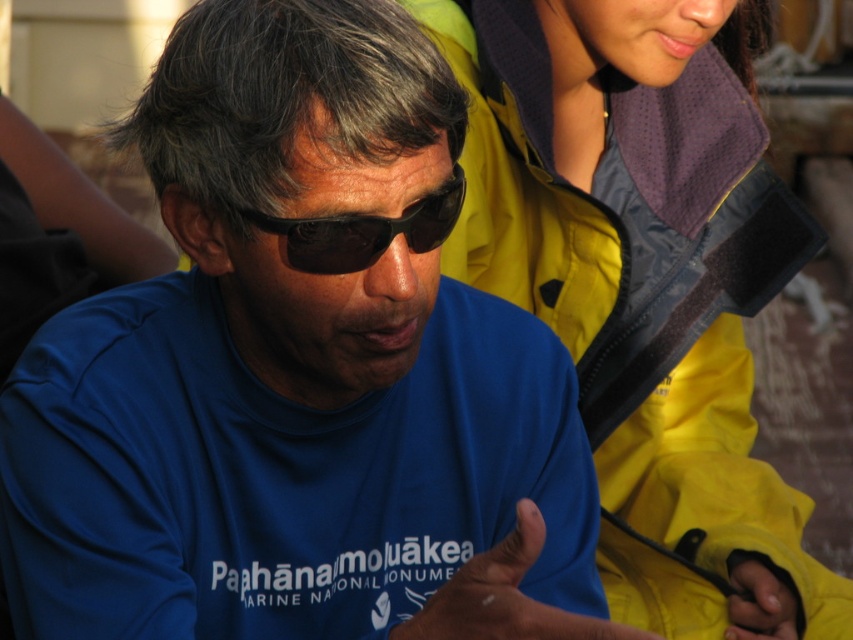
Question: Which point is farther to the camera?

Choices:
 (A) black plastic goggles at center
 (B) yellow fabric hand at lower right
 (C) blue matte hand at center
 (D) yellow waterproof jacket at upper right

Answer: (D)

Question: Does yellow waterproof jacket at upper right have a lesser width compared to black plastic goggles at center?

Choices:
 (A) yes
 (B) no

Answer: (B)

Question: Which point appears closest to the camera in this image?

Choices:
 (A) (743, 634)
 (B) (538, 625)
 (C) (607, 316)
 (D) (352, 227)

Answer: (B)

Question: Does blue matte hand at center have a greater width compared to yellow fabric hand at lower right?

Choices:
 (A) no
 (B) yes

Answer: (B)

Question: Can you confirm if yellow waterproof jacket at upper right is positioned to the left of yellow fabric hand at lower right?

Choices:
 (A) yes
 (B) no

Answer: (A)

Question: Which object is closer to the camera taking this photo?

Choices:
 (A) black plastic goggles at center
 (B) yellow fabric hand at lower right

Answer: (A)